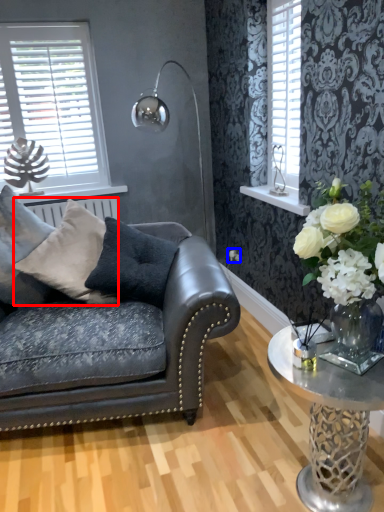
Question: Which object appears farthest to the camera in this image, pillow (highlighted by a red box) or flower (highlighted by a blue box)?

Choices:
 (A) pillow
 (B) flower

Answer: (B)